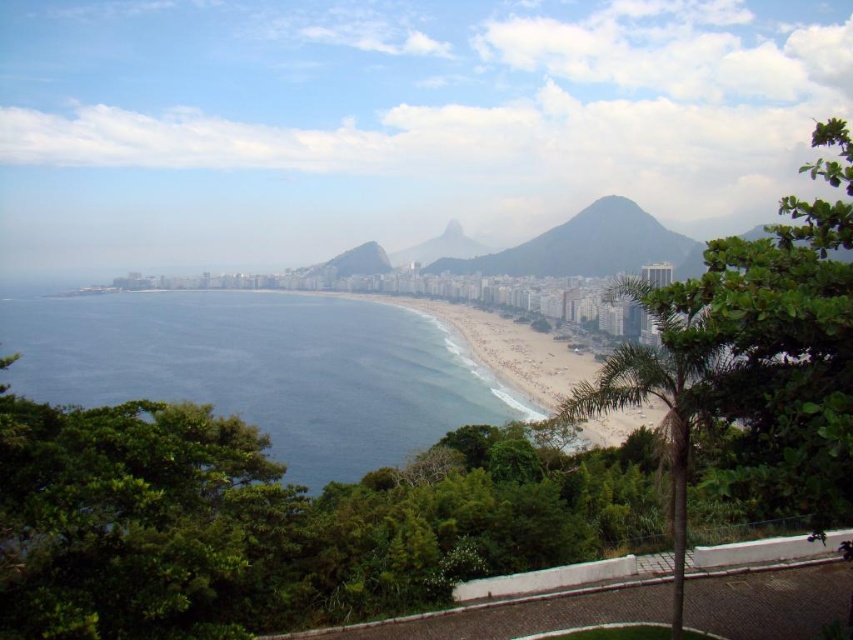
Question: Can you confirm if blue water at center is positioned to the right of green textured mountain at center?

Choices:
 (A) no
 (B) yes

Answer: (A)

Question: Which of the following is the farthest from the observer?

Choices:
 (A) (303, 412)
 (B) (566, 273)

Answer: (B)

Question: Does blue water at center appear over green textured mountain at center?

Choices:
 (A) no
 (B) yes

Answer: (A)

Question: Which point appears closest to the camera in this image?

Choices:
 (A) (593, 209)
 (B) (16, 371)

Answer: (A)

Question: Can you confirm if blue water at center is positioned below green textured mountain at center?

Choices:
 (A) no
 (B) yes

Answer: (B)